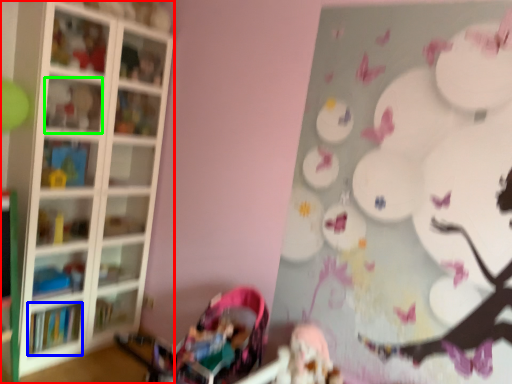
Question: Which object is positioned farthest from shelf (highlighted by a red box)? Select from book (highlighted by a blue box) and shelf (highlighted by a green box).

Choices:
 (A) book
 (B) shelf

Answer: (A)